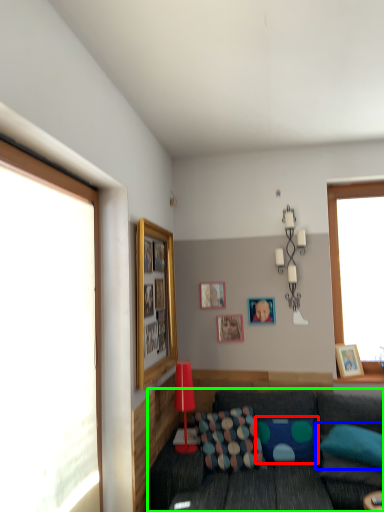
Question: Which object is the farthest from pillow (highlighted by a red box)? Choose among these: pillow (highlighted by a blue box) or studio couch (highlighted by a green box).

Choices:
 (A) pillow
 (B) studio couch

Answer: (A)